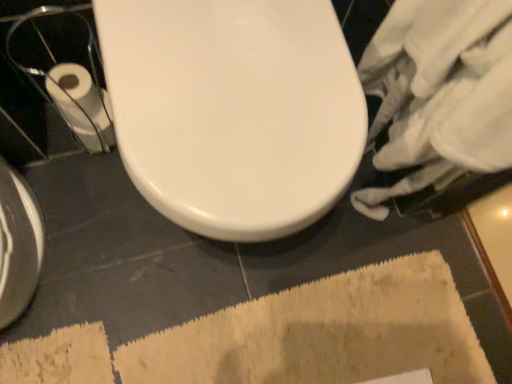
You are a GUI agent. You are given a task and a screenshot of the screen. Output one action in this format:
    pyautogui.click(x=<x>, y=<y>)
    Task: Click on the vacant space situated above white glossy toilet at center (from a real-world perspective)
    
    Given the screenshot: What is the action you would take?
    pyautogui.click(x=239, y=79)